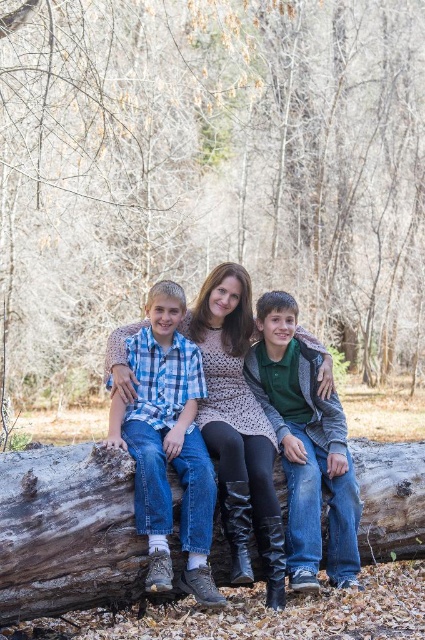
Question: Which object is the farthest from the brown wood log at lower center?

Choices:
 (A) brown rough tree trunk at center
 (B) plaid cotton shirt at left

Answer: (A)

Question: Considering the real-world distances, which object is farthest from the knit sweater at center?

Choices:
 (A) plaid cotton shirt at left
 (B) green cotton shirt at center
 (C) brown wood log at lower center

Answer: (C)

Question: Which point is closer to the camera taking this photo?

Choices:
 (A) (390, 461)
 (B) (152, 339)
 (C) (255, 364)

Answer: (B)

Question: Can you confirm if plaid cotton shirt at left is smaller than green cotton shirt at center?

Choices:
 (A) yes
 (B) no

Answer: (B)

Question: Does brown wood log at lower center appear over green cotton shirt at center?

Choices:
 (A) yes
 (B) no

Answer: (A)

Question: Does brown wood log at lower center have a lesser width compared to green cotton shirt at center?

Choices:
 (A) no
 (B) yes

Answer: (A)